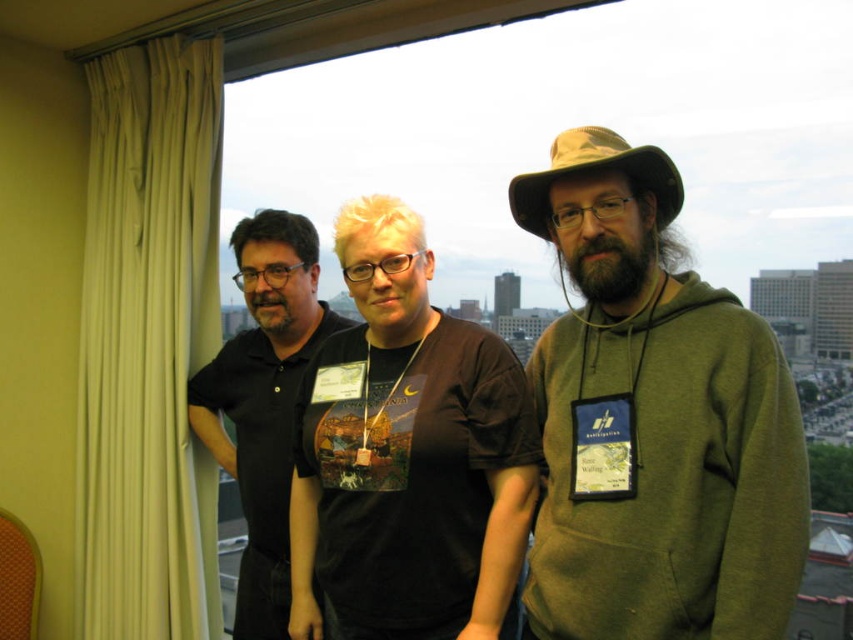
Question: Is green matte hoodie at right thinner than black matte shirt at left?

Choices:
 (A) no
 (B) yes

Answer: (A)

Question: Estimate the real-world distances between objects in this image. Which object is farther from the black matte shirt at left?

Choices:
 (A) black matte t-shirt at center
 (B) green matte hoodie at right

Answer: (B)

Question: Is green matte hoodie at right to the left of black matte t-shirt at center from the viewer's perspective?

Choices:
 (A) yes
 (B) no

Answer: (B)

Question: Is green matte hoodie at right further to camera compared to black matte t-shirt at center?

Choices:
 (A) no
 (B) yes

Answer: (A)

Question: Which object is the closest to the green matte hoodie at right?

Choices:
 (A) black matte shirt at left
 (B) black matte t-shirt at center

Answer: (B)

Question: Among these points, which one is farthest from the camera?

Choices:
 (A) (589, 387)
 (B) (462, 470)
 (C) (212, 368)

Answer: (C)